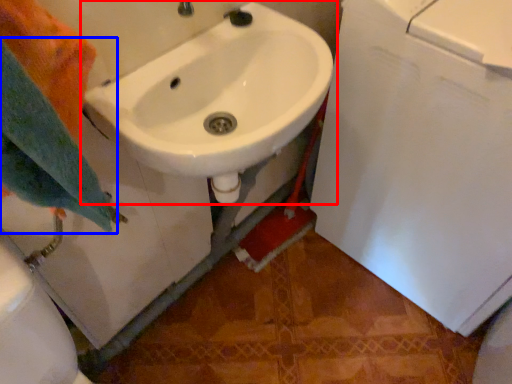
Question: Which object appears closest to the camera in this image, sink (highlighted by a red box) or bath towel (highlighted by a blue box)?

Choices:
 (A) sink
 (B) bath towel

Answer: (B)